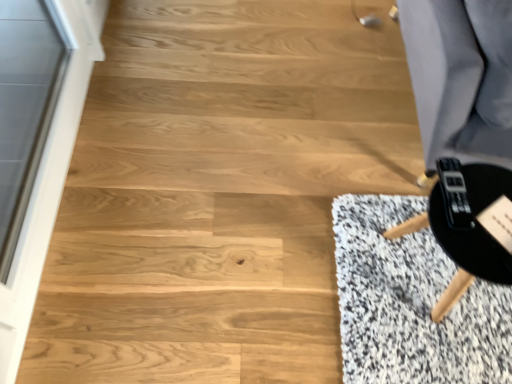
Question: Considering their positions, is black matte game controller at lower right located in front of or behind transparent glass screen door at left?

Choices:
 (A) front
 (B) behind

Answer: (B)

Question: Choose the correct answer: Is black matte game controller at lower right inside transparent glass screen door at left or outside it?

Choices:
 (A) inside
 (B) outside

Answer: (B)

Question: Considering the real-world distances, which object is farthest from the black matte game controller at lower right?

Choices:
 (A) transparent glass screen door at left
 (B) black matte round table at lower right

Answer: (A)

Question: Considering the real-world distances, which object is closest to the black matte round table at lower right?

Choices:
 (A) transparent glass screen door at left
 (B) black matte game controller at lower right

Answer: (B)